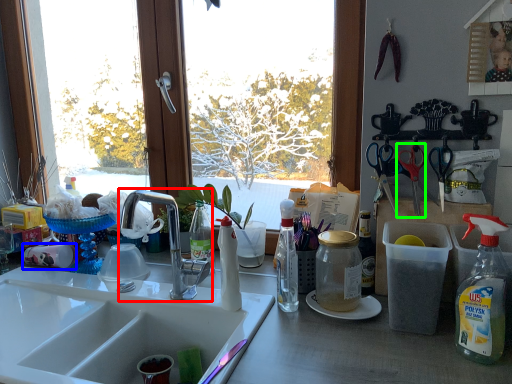
Question: Which object is the closest to the tap (highlighted by a red box)? Choose among these: coffee cup (highlighted by a blue box) or scissors (highlighted by a green box).

Choices:
 (A) coffee cup
 (B) scissors

Answer: (A)